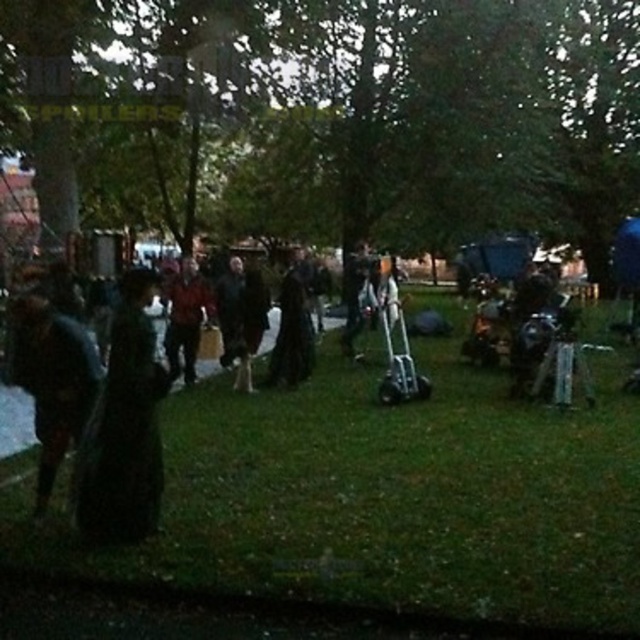
Who is more forward, [480,580] or [177,342]?

Point [480,580]

Can you confirm if green grass at center is positioned above red fabric jacket at center?

No.

Who is more distant from viewer, [369,461] or [193,353]?

Point [193,353]

Where is `green grass at center`? green grass at center is located at coordinates (388, 497).

Which is more to the right, dark green fabric dress at center or dark matte robe at center?

dark matte robe at center is more to the right.

Can you confirm if dark green fabric dress at center is positioned above dark matte robe at center?

Incorrect, dark green fabric dress at center is not positioned above dark matte robe at center.

This screenshot has height=640, width=640. Find the location of `dark green fabric dress at center`. dark green fabric dress at center is located at coordinates (124, 428).

Where is `dark brown leather jacket at left`? This screenshot has width=640, height=640. dark brown leather jacket at left is located at coordinates (52, 378).

Looking at this image, does dark brown leather jacket at left have a larger size compared to dark matte robe at center?

No.

Does point (52, 365) come behind point (273, 384)?

No, (52, 365) is in front of (273, 384).

Identify the location of dark brown leather jacket at left. (52, 378).